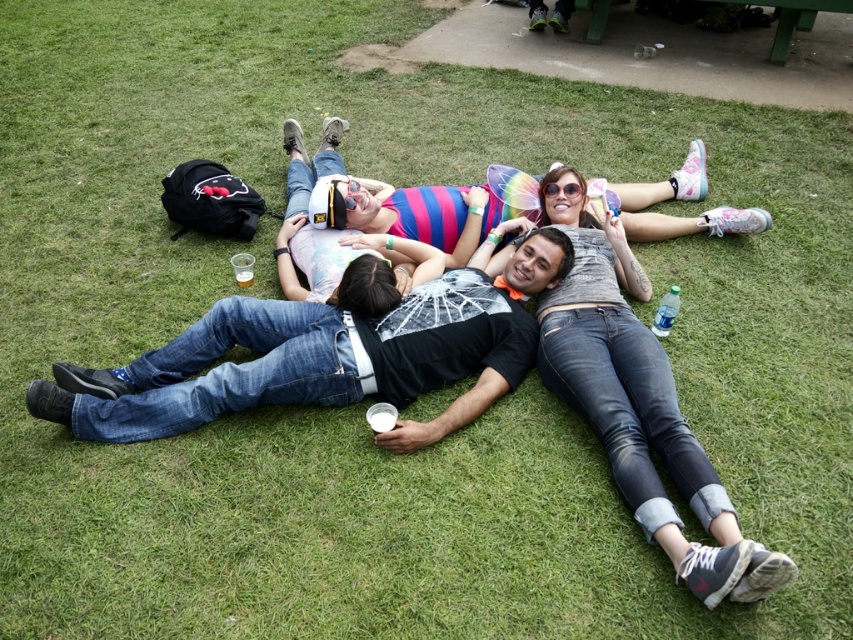
Based on the scene description, can you determine if the denim jeans at center are closer to the observer than the translucent plastic cup at center?

Yes, the denim jeans at center is in front of the translucent plastic cup at center, so it is closer to the observer.

You are standing at the point marked by coordinates point (531, 284). You want to throw a frisbee to your friend who is standing 3 meters away from you. Is your friend within reach?

The distance between you and the viewer is 3.13 meters, so your friend is just beyond the 3 meters range. You might need to take a step closer or throw a bit harder.

How far apart are the two people wearing jeans at center?

The two people wearing jeans at center are 2.56 meters apart.